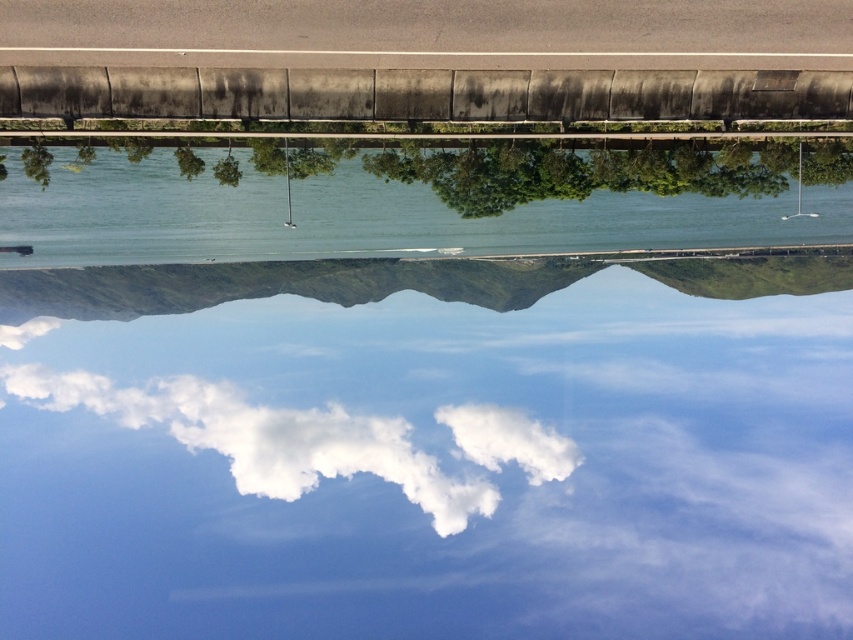
You are standing at the concrete barrier in the midground of the image. You see two points marked on the barrier. One is at point coordinates (518, 150) and the other at (300, 410). Which point is physically closer to your current position?

Point (518, 150) is closer to the viewer than point (300, 410), so the point at coordinates (518, 150) is physically closer to your current position at the concrete barrier.

From the picture: You are a drone operator planning to fly a drone from the clear water at center to the white fluffy cloud at center. Given that the drone has a maximum flight range of 500 feet, will it be able to reach the cloud without needing to recharge?

The distance between the clear water at center and the white fluffy cloud at center is 557.18 feet, which exceeds the drone operator drone has a maximum flight range of 500 feet. Therefore, the drone will not be able to reach the white fluffy cloud at center without recharging.